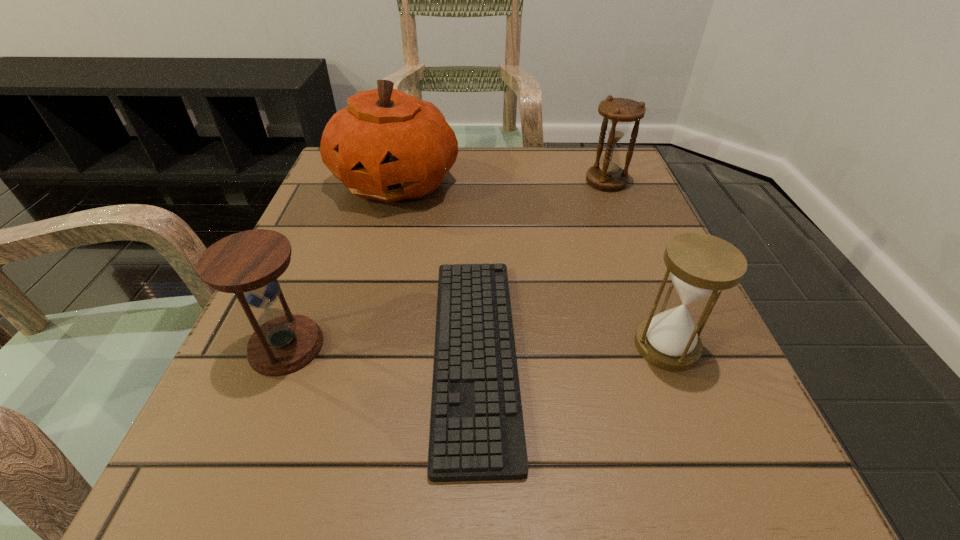
Locate an element on the screen. This screenshot has width=960, height=540. the tallest object is located at coordinates (387, 145).

The height and width of the screenshot is (540, 960). In order to click on the farthest hourglass in this screenshot , I will do `click(619, 113)`.

Locate an element on the screen. This screenshot has height=540, width=960. the leftmost hourglass is located at coordinates (248, 263).

You are a GUI agent. You are given a task and a screenshot of the screen. Output one action in this format:
    pyautogui.click(x=<x>, y=<y>)
    Task: Click on the computer keyboard
    The image size is (960, 540).
    Given the screenshot: What is the action you would take?
    pyautogui.click(x=477, y=433)

Identify the location of free spot located on the front-facing side of the tallest object. The height and width of the screenshot is (540, 960). (344, 379).

This screenshot has width=960, height=540. What are the coordinates of `vacant space located 0.260m on the left of the farthest hourglass` in the screenshot? It's located at (470, 181).

You are a GUI agent. You are given a task and a screenshot of the screen. Output one action in this format:
    pyautogui.click(x=<x>, y=<y>)
    Task: Click on the vacant space positioned 0.080m on the back of the leftmost hourglass
    Image resolution: width=960 pixels, height=540 pixels.
    Given the screenshot: What is the action you would take?
    pyautogui.click(x=311, y=284)

Where is `vacant space located on the back of the computer keyboard`? The height and width of the screenshot is (540, 960). vacant space located on the back of the computer keyboard is located at coordinates (477, 167).

Locate an element on the screen. This screenshot has width=960, height=540. pumpkin that is at the far edge is located at coordinates (387, 145).

What are the coordinates of `hourglass that is at the far edge` in the screenshot? It's located at (619, 113).